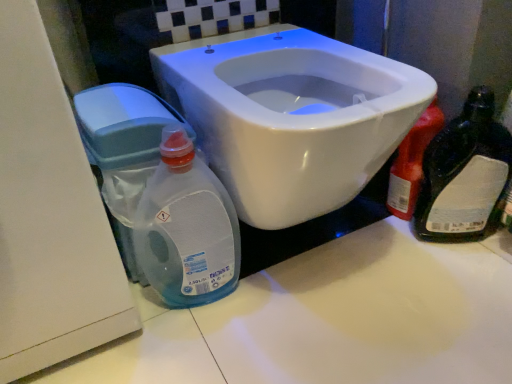
The width and height of the screenshot is (512, 384). What do you see at coordinates (124, 149) in the screenshot? I see `transparent plastic water tank at lower left` at bounding box center [124, 149].

Describe the element at coordinates (465, 175) in the screenshot. I see `translucent plastic bottle at right` at that location.

In order to click on translucent plastic bottle at right in this screenshot , I will do `click(465, 175)`.

Where is `translucent plastic bottle at right`? The height and width of the screenshot is (384, 512). translucent plastic bottle at right is located at coordinates (412, 163).

Identify the location of transparent plastic water tank at lower left. This screenshot has width=512, height=384. (124, 149).

From a real-world perspective, which object stands above the other?

In real-world perspective, transparent plastic bottle at lower left is above.

Considering the positions of point (410, 154) and point (157, 185), is point (410, 154) closer or farther from the camera than point (157, 185)?

Point (410, 154) appears to be farther away from the viewer than point (157, 185).

From the picture: Is translucent plastic bottle at right at the left side of transparent plastic bottle at lower left?

No, translucent plastic bottle at right is not to the left of transparent plastic bottle at lower left.

Is translucent plastic bottle at right touching translucent plastic bottle at right?

Yes.

Is point (445, 216) behind point (420, 138)?

That is False.

From the image's perspective, which is above, translucent plastic bottle at right or translucent plastic bottle at right?

From the image's view, translucent plastic bottle at right is above.

Does translucent plastic bottle at right have a greater height compared to translucent plastic bottle at right?

Indeed, translucent plastic bottle at right has a greater height compared to translucent plastic bottle at right.

Which object is more forward, transparent plastic water tank at lower left or translucent plastic bottle at right?

transparent plastic water tank at lower left is closer to the camera.

From the image's perspective, which is above, transparent plastic water tank at lower left or translucent plastic bottle at right?

From the image's view, translucent plastic bottle at right is above.

Based on their sizes in the image, would you say transparent plastic water tank at lower left is bigger or smaller than translucent plastic bottle at right?

Clearly, transparent plastic water tank at lower left is larger in size than translucent plastic bottle at right.

Would you say translucent plastic bottle at right is a long distance from white glossy toilet at center?

No, there isn't a large distance between translucent plastic bottle at right and white glossy toilet at center.

Who is shorter, translucent plastic bottle at right or white glossy toilet at center?

With less height is translucent plastic bottle at right.

Is translucent plastic bottle at right turned away from white glossy toilet at center?

No.

Which point is more distant from viewer, (431, 102) or (253, 78)?

The point (253, 78) is more distant.

Which of these two, white glossy toilet at center or transparent plastic water tank at lower left, stands taller?

Standing taller between the two is white glossy toilet at center.

From a real-world perspective, is white glossy toilet at center positioned above or below transparent plastic water tank at lower left?

Clearly, from a real-world perspective, white glossy toilet at center is above transparent plastic water tank at lower left.

Is white glossy toilet at center touching transparent plastic water tank at lower left?

white glossy toilet at center and transparent plastic water tank at lower left are clearly separated.

From the image's perspective, is white glossy toilet at center on top of transparent plastic water tank at lower left?

Yes.

Is transparent plastic bottle at lower left next to translucent plastic bottle at right?

No.

Looking at this image, looking at their sizes, would you say transparent plastic bottle at lower left is wider or thinner than translucent plastic bottle at right?

Clearly, transparent plastic bottle at lower left has more width compared to translucent plastic bottle at right.

Would you say transparent plastic bottle at lower left contains translucent plastic bottle at right?

No, translucent plastic bottle at right is located outside of transparent plastic bottle at lower left.

From the image's perspective, relative to translucent plastic bottle at right, is transparent plastic bottle at lower left above or below?

Based on their image positions, transparent plastic bottle at lower left is located beneath translucent plastic bottle at right.

Between transparent plastic bottle at lower left and translucent plastic bottle at right, which one has smaller size?

translucent plastic bottle at right is smaller.

Is transparent plastic bottle at lower left located outside translucent plastic bottle at right?

That's correct, transparent plastic bottle at lower left is outside of translucent plastic bottle at right.

From the image's perspective, is transparent plastic bottle at lower left below translucent plastic bottle at right?

Yes.

Which object is thinner, transparent plastic bottle at lower left or translucent plastic bottle at right?

translucent plastic bottle at right.

Image resolution: width=512 pixels, height=384 pixels. In the image, there is a transparent plastic bottle at lower left. Find the location of `cleaning product below it (from a real-world perspective)`. cleaning product below it (from a real-world perspective) is located at coordinates (412, 163).

Locate an element on the screen. This screenshot has width=512, height=384. bottle in front of the translucent plastic bottle at right is located at coordinates (465, 175).

Estimate the real-world distances between objects in this image. Which object is closer to white glossy toilet at center, transparent plastic bottle at lower left or translucent plastic bottle at right?

The object closer to white glossy toilet at center is transparent plastic bottle at lower left.

Which object lies nearer to the anchor point translucent plastic bottle at right, transparent plastic water tank at lower left or transparent plastic bottle at lower left?

transparent plastic bottle at lower left is closer to translucent plastic bottle at right.

When comparing their distances from transparent plastic bottle at lower left, does translucent plastic bottle at right or white glossy toilet at center seem closer?

white glossy toilet at center lies closer to transparent plastic bottle at lower left than the other object.

Looking at the image, which one is located further to translucent plastic bottle at right, translucent plastic bottle at right or transparent plastic water tank at lower left?

The object further to translucent plastic bottle at right is transparent plastic water tank at lower left.

From the image, which object appears to be nearer to transparent plastic water tank at lower left, transparent plastic bottle at lower left or white glossy toilet at center?

The object closer to transparent plastic water tank at lower left is transparent plastic bottle at lower left.

Considering their positions, is transparent plastic bottle at lower left positioned further to translucent plastic bottle at right than translucent plastic bottle at right?

Based on the image, transparent plastic bottle at lower left appears to be further to translucent plastic bottle at right.

Considering their positions, is white glossy toilet at center positioned further to transparent plastic bottle at lower left than translucent plastic bottle at right?

translucent plastic bottle at right is positioned further to the anchor transparent plastic bottle at lower left.

Considering their positions, is transparent plastic water tank at lower left positioned closer to white glossy toilet at center than translucent plastic bottle at right?

transparent plastic water tank at lower left is positioned closer to the anchor white glossy toilet at center.

Find the location of `toilet between transparent plastic bottle at lower left and translucent plastic bottle at right from left to right`. toilet between transparent plastic bottle at lower left and translucent plastic bottle at right from left to right is located at coordinates (291, 116).

Locate an element on the screen. Image resolution: width=512 pixels, height=384 pixels. baby bottle located between transparent plastic water tank at lower left and white glossy toilet at center in the left-right direction is located at coordinates (186, 228).

Locate an element on the screen. This screenshot has height=384, width=512. baby bottle situated between transparent plastic water tank at lower left and translucent plastic bottle at right from left to right is located at coordinates (186, 228).

The width and height of the screenshot is (512, 384). What are the coordinates of `toilet located between transparent plastic bottle at lower left and translucent plastic bottle at right in the left-right direction` in the screenshot? It's located at (291, 116).